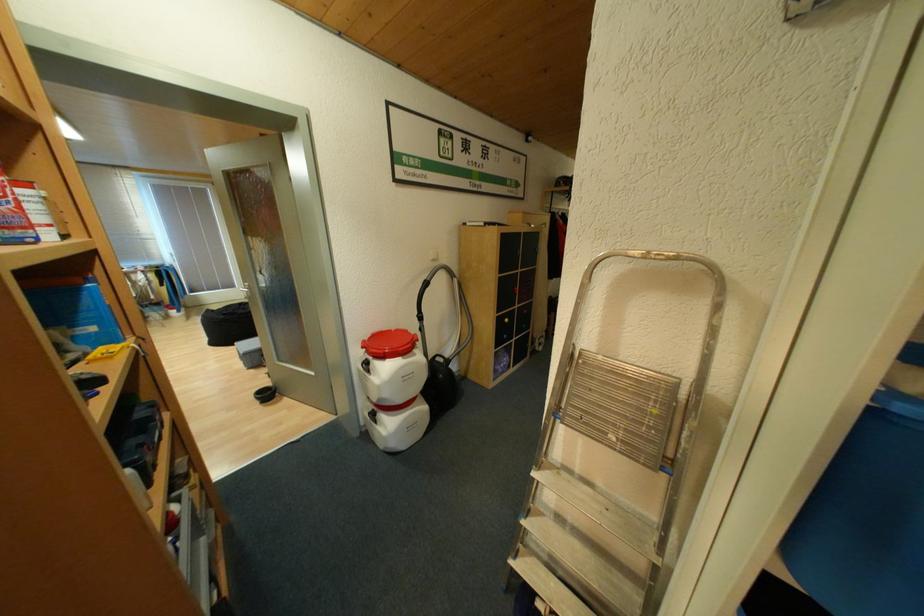
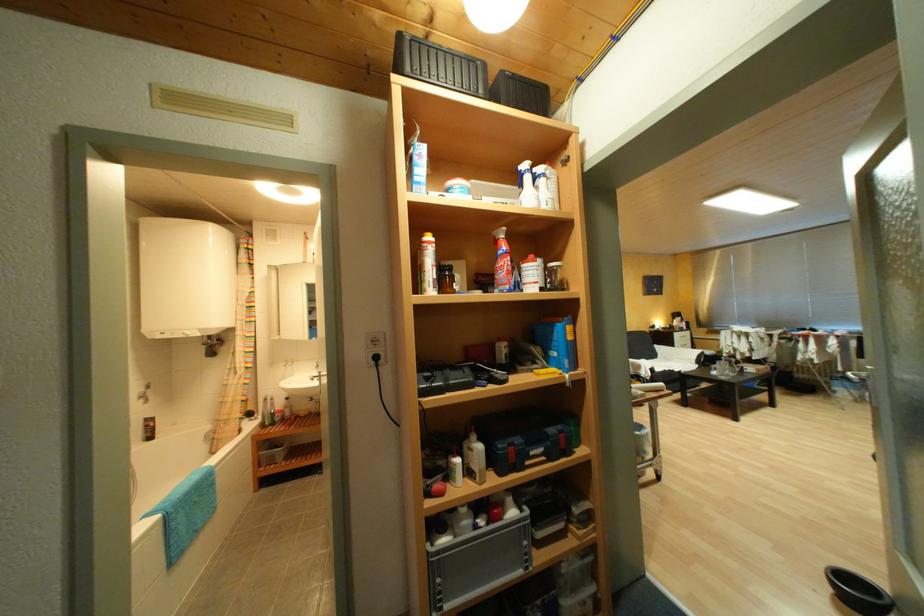
Find the pixel in the second image that matches point (276, 397) in the first image.

(870, 600)